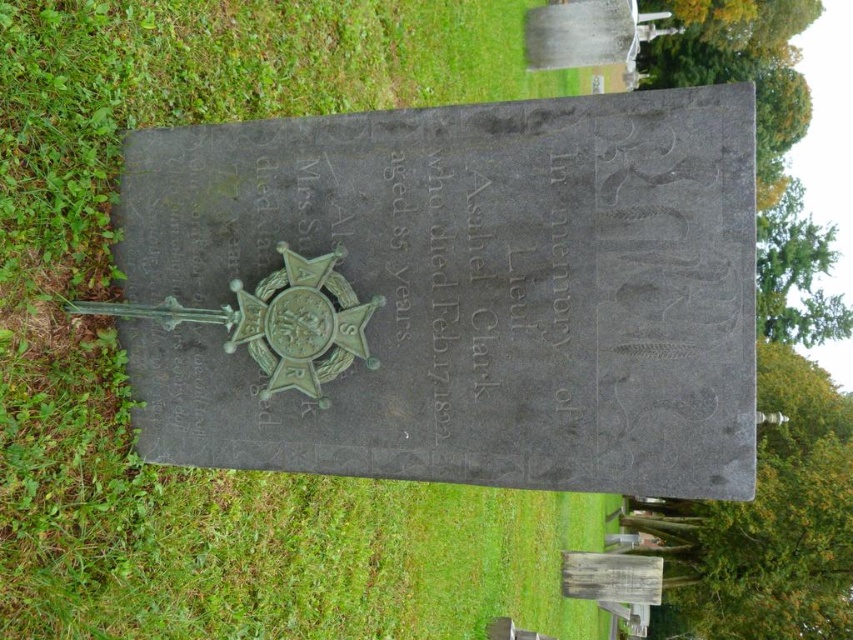
Question: Does green stone plaque at center appear on the left side of green grass at center?

Choices:
 (A) no
 (B) yes

Answer: (B)

Question: Is green stone plaque at center to the right of green grass at center from the viewer's perspective?

Choices:
 (A) no
 (B) yes

Answer: (A)

Question: Which of the following is the closest to the observer?

Choices:
 (A) (358, 276)
 (B) (51, 90)

Answer: (A)

Question: Does green stone plaque at center lie in front of green grass at center?

Choices:
 (A) no
 (B) yes

Answer: (B)

Question: Which object is closer to the camera taking this photo?

Choices:
 (A) green grass at center
 (B) green stone plaque at center

Answer: (B)